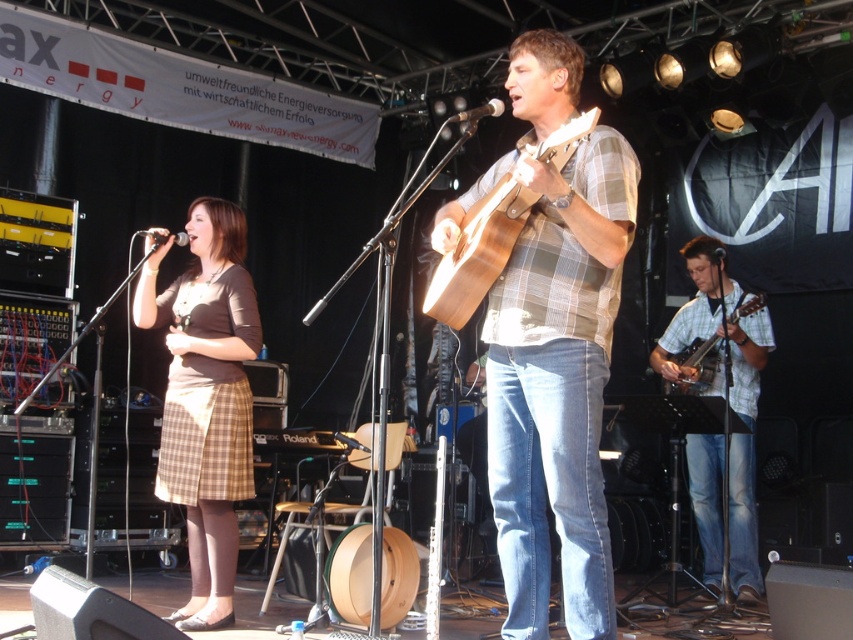
Can you confirm if matte brown guitar at center is positioned below wooden acoustic guitar at right?

No.

Does matte brown guitar at center have a greater height compared to wooden acoustic guitar at right?

Yes, matte brown guitar at center is taller than wooden acoustic guitar at right.

Does point (589, 580) come closer to viewer compared to point (693, 353)?

Yes, it is in front of point (693, 353).

Where is `matte brown guitar at center`? matte brown guitar at center is located at coordinates (553, 376).

Which is more to the right, brown plaid skirt at left or wooden acoustic guitar at right?

Positioned to the right is wooden acoustic guitar at right.

This screenshot has height=640, width=853. What do you see at coordinates (206, 400) in the screenshot?
I see `brown plaid skirt at left` at bounding box center [206, 400].

Is point (245, 353) positioned after point (758, 305)?

No, it is not.

Where is `brown plaid skirt at left`? The image size is (853, 640). brown plaid skirt at left is located at coordinates (206, 400).

Does brown plaid skirt at left appear on the right side of metallic silver microphone at upper center?

Incorrect, brown plaid skirt at left is not on the right side of metallic silver microphone at upper center.

Who is more forward, (224, 620) or (476, 118)?

Point (476, 118) is in front.

At what (x,y) coordinates should I click in order to perform the action: click on brown plaid skirt at left. Please return your answer as a coordinate pair (x, y). The width and height of the screenshot is (853, 640). Looking at the image, I should click on (206, 400).